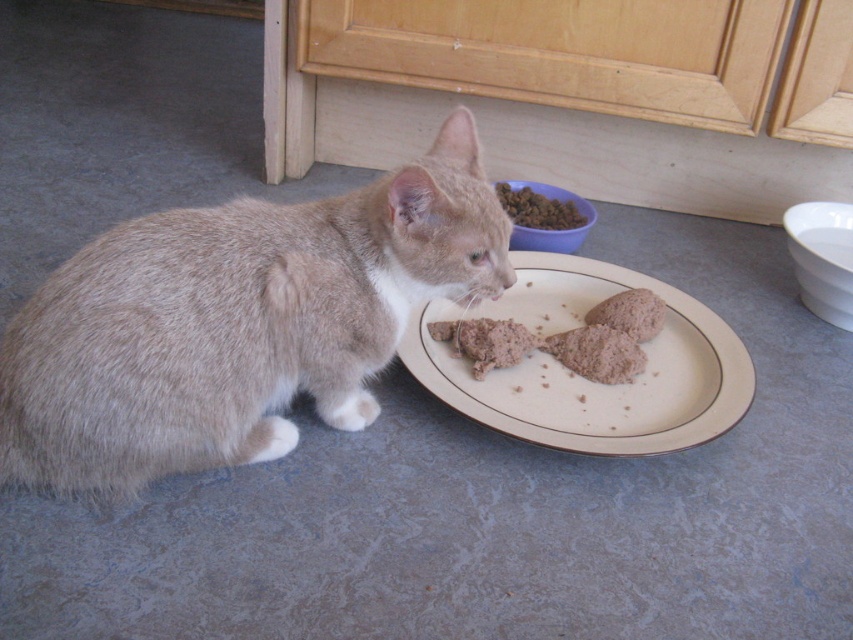
Question: Which point is farther to the camera?

Choices:
 (A) (628, 316)
 (B) (567, 211)
 (C) (583, 321)

Answer: (B)

Question: Observing the image, what is the correct spatial positioning of brown crumbly food at center in reference to dry kibble at upper center?

Choices:
 (A) right
 (B) left

Answer: (A)

Question: Which point is farther from the camera taking this photo?

Choices:
 (A) (244, 454)
 (B) (642, 292)
 (C) (602, 333)

Answer: (B)

Question: Does brown textured food at plate center have a larger size compared to dry kibble at upper center?

Choices:
 (A) yes
 (B) no

Answer: (A)

Question: Estimate the real-world distances between objects in this image. Which object is closer to the brown textured food at plate center?

Choices:
 (A) beige ceramic plate at center
 (B) soft fur cat at lower left
 (C) brown crumbly food at center
 (D) gray fur cat at left

Answer: (A)

Question: Is brown crumbly food at plate center positioned in front of dry kibble at upper center?

Choices:
 (A) yes
 (B) no

Answer: (A)